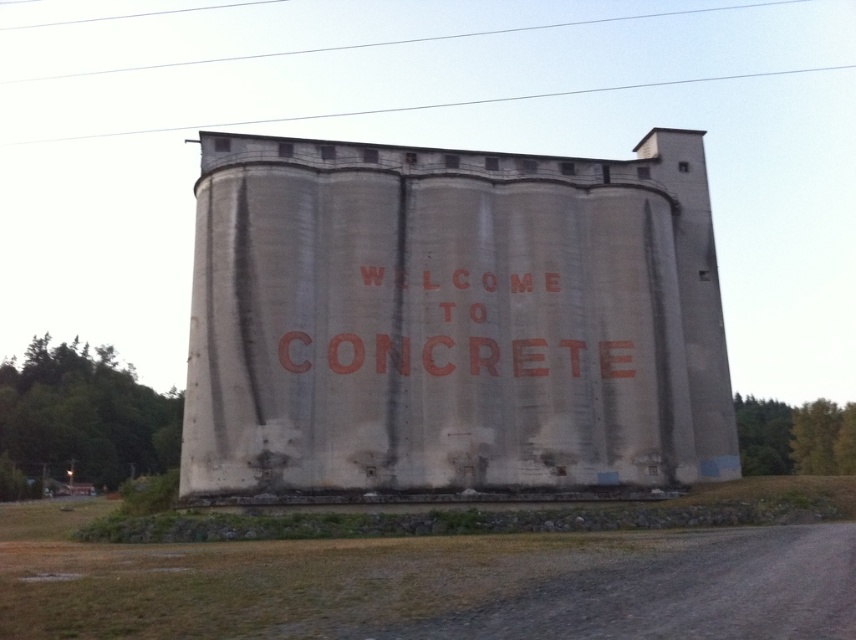
Between point (236, 392) and point (590, 20), which one is positioned in front?

Point (236, 392) is in front.

Consider the image. Between gray concrete silo at center and smooth white power line at upper center, which one has less height?

Standing shorter between the two is smooth white power line at upper center.

At what (x,y) coordinates should I click in order to perform the action: click on gray concrete silo at center. Please return your answer as a coordinate pair (x, y). This screenshot has height=640, width=856. Looking at the image, I should click on (452, 320).

Does gray concrete silo at center have a lesser width compared to smooth wire at upper center?

Correct, gray concrete silo at center's width is less than smooth wire at upper center's.

Does gray concrete silo at center appear over smooth wire at upper center?

No, gray concrete silo at center is not above smooth wire at upper center.

Where is `gray concrete silo at center`? This screenshot has height=640, width=856. gray concrete silo at center is located at coordinates (452, 320).

Find the location of a particular element. The image size is (856, 640). gray concrete silo at center is located at coordinates (452, 320).

Does smooth wire at upper center appear over smooth white power line at upper center?

Incorrect, smooth wire at upper center is not positioned above smooth white power line at upper center.

Is point (212, 125) in front of point (764, 6)?

Yes.

This screenshot has height=640, width=856. Find the location of `smooth wire at upper center`. smooth wire at upper center is located at coordinates (423, 106).